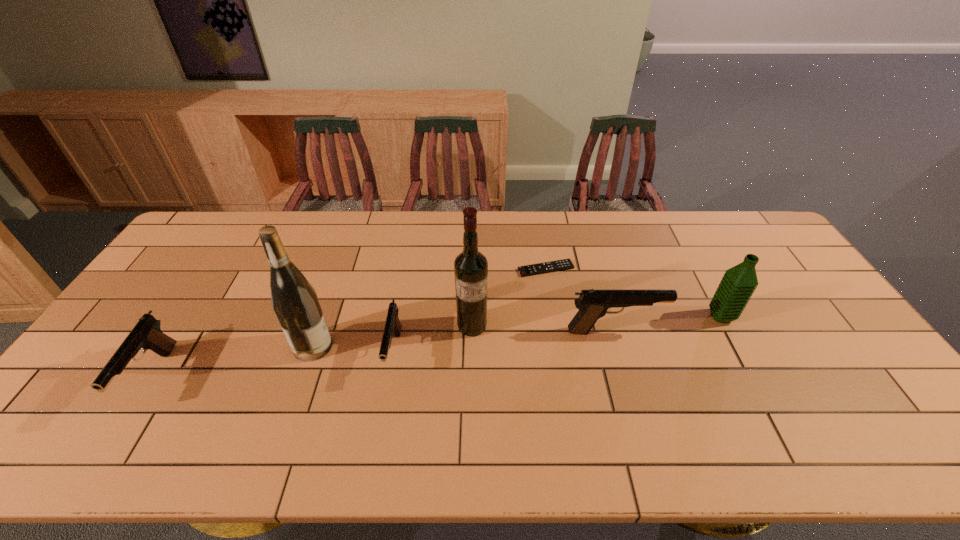
Image resolution: width=960 pixels, height=540 pixels. Identify the location of free point that keeps the pistols evenly spaced on the right. (815, 310).